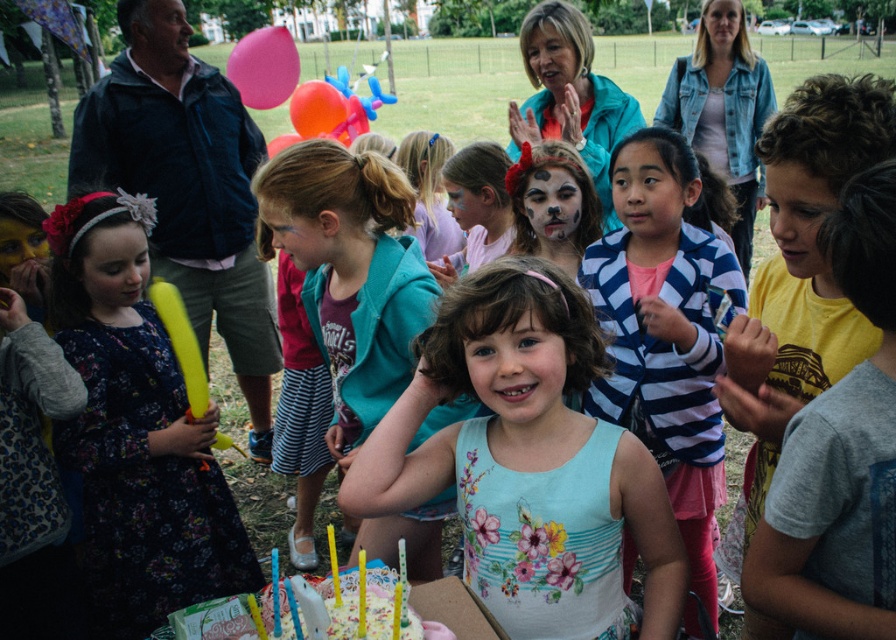
Is floral printed tank top at center positioned in front of teal hoodie at center?

Yes, it is in front of teal hoodie at center.

What do you see at coordinates (526, 458) in the screenshot?
I see `floral printed tank top at center` at bounding box center [526, 458].

Who is more forward, (464, 428) or (339, 273)?

Point (464, 428) is in front.

Identify the location of floral printed tank top at center. The width and height of the screenshot is (896, 640). (526, 458).

Is teal hoodie at center above rubber balloon at center?

Incorrect, teal hoodie at center is not positioned above rubber balloon at center.

Find the location of a particular element. The width and height of the screenshot is (896, 640). teal hoodie at center is located at coordinates (349, 273).

Where is `teal hoodie at center`? The image size is (896, 640). teal hoodie at center is located at coordinates (349, 273).

Can you confirm if floral printed tank top at center is wider than rubber balloon at center?

Indeed, floral printed tank top at center has a greater width compared to rubber balloon at center.

Which is behind, point (657, 628) or point (307, 116)?

The point (307, 116) is more distant.

Where is `floral printed tank top at center`? floral printed tank top at center is located at coordinates (526, 458).

Where is `floral printed tank top at center`? Image resolution: width=896 pixels, height=640 pixels. floral printed tank top at center is located at coordinates (526, 458).